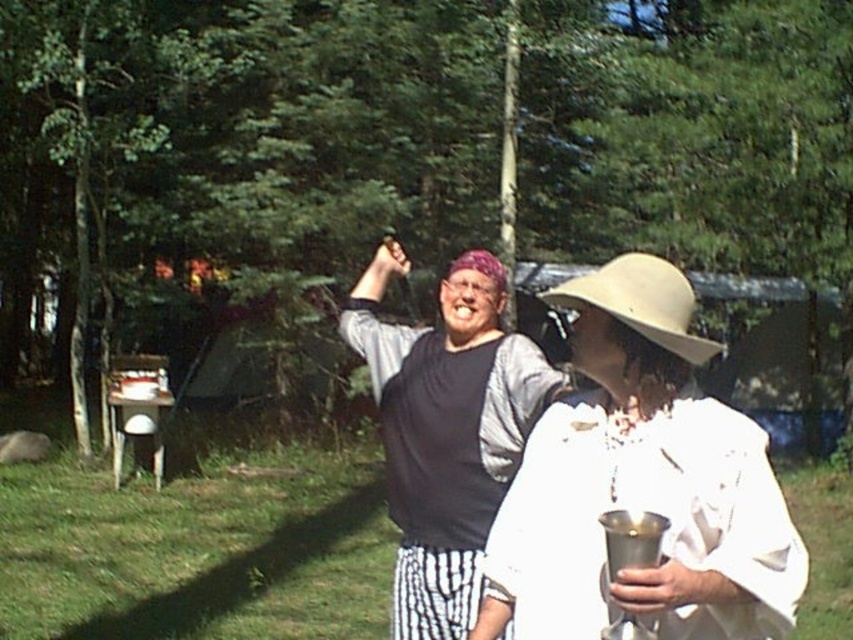
Question: Considering the real-world distances, which object is farthest from the beige fabric hat at upper center?

Choices:
 (A) matte black shirt at center
 (B) white matte hat at center

Answer: (A)

Question: Can you confirm if white matte hat at center is positioned above beige fabric hat at upper center?

Choices:
 (A) no
 (B) yes

Answer: (A)

Question: Which of the following is the farthest from the observer?

Choices:
 (A) white matte hat at center
 (B) matte black shirt at center
 (C) beige fabric hat at upper center

Answer: (B)

Question: Does matte black shirt at center have a greater width compared to beige fabric hat at upper center?

Choices:
 (A) no
 (B) yes

Answer: (A)

Question: Which point is farther to the camera?

Choices:
 (A) white matte hat at center
 (B) matte black shirt at center

Answer: (B)

Question: Does white matte hat at center have a lesser width compared to matte black shirt at center?

Choices:
 (A) no
 (B) yes

Answer: (B)